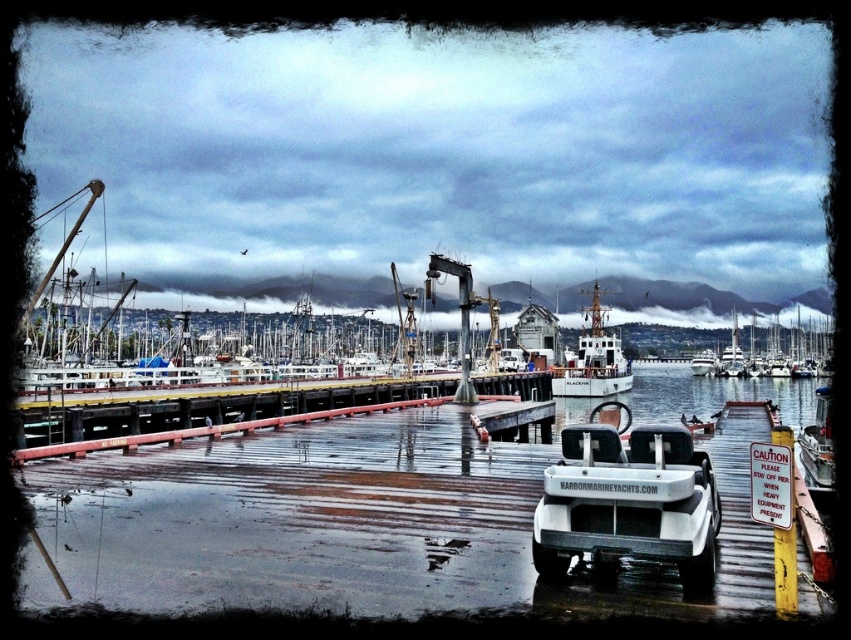
Is smooth wooden dock at center closer to camera compared to white matte ship at center?

Yes, smooth wooden dock at center is closer to the viewer.

Which is behind, point (107, 440) or point (618, 384)?

Positioned behind is point (618, 384).

Is point (94, 445) in front of point (597, 346)?

Yes.

This screenshot has width=851, height=640. I want to click on smooth wooden dock at center, so click(206, 417).

Which of these two, smooth wooden dock at center or white glossy boat at right, stands taller?

Standing taller between the two is smooth wooden dock at center.

Is smooth wooden dock at center taller than white glossy boat at right?

Yes, smooth wooden dock at center is taller than white glossy boat at right.

Where is `smooth wooden dock at center`? Image resolution: width=851 pixels, height=640 pixels. smooth wooden dock at center is located at coordinates (206, 417).

Identify the location of smooth wooden dock at center. click(206, 417).

Locate an element on the screen. white matte ship at center is located at coordinates (592, 358).

The height and width of the screenshot is (640, 851). Describe the element at coordinates (592, 358) in the screenshot. I see `white matte ship at center` at that location.

Who is more distant from viewer, (x=592, y=369) or (x=820, y=458)?

Positioned behind is point (x=592, y=369).

At what (x,y) coordinates should I click in order to perform the action: click on white matte ship at center. Please return your answer as a coordinate pair (x, y). The height and width of the screenshot is (640, 851). Looking at the image, I should click on point(592,358).